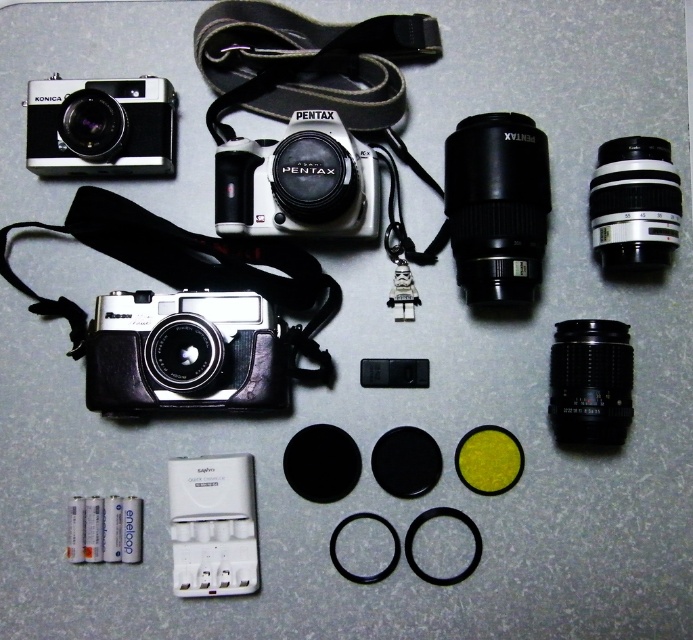
Question: Can you confirm if black leather strap at upper center is smaller than matte silver camera at center?

Choices:
 (A) yes
 (B) no

Answer: (B)

Question: Is matte black camera at center further to camera compared to matte silver camera at center?

Choices:
 (A) no
 (B) yes

Answer: (B)

Question: Considering the real-world distances, which object is farthest from the black plastic lens at upper right?

Choices:
 (A) matte silver camera at center
 (B) black leather strap at upper center
 (C) black plastic lens at lower right

Answer: (B)

Question: Can you confirm if matte silver camera at center is bigger than black plastic lens at upper right?

Choices:
 (A) no
 (B) yes

Answer: (B)

Question: Which of the following is the farthest from the observer?

Choices:
 (A) (529, 166)
 (B) (137, 336)
 (C) (613, 435)

Answer: (B)

Question: Estimate the real-world distances between objects in this image. Which object is farther from the matte black camera at upper left?

Choices:
 (A) black plastic lens at upper right
 (B) matte black camera at center
 (C) matte silver camera at center

Answer: (A)